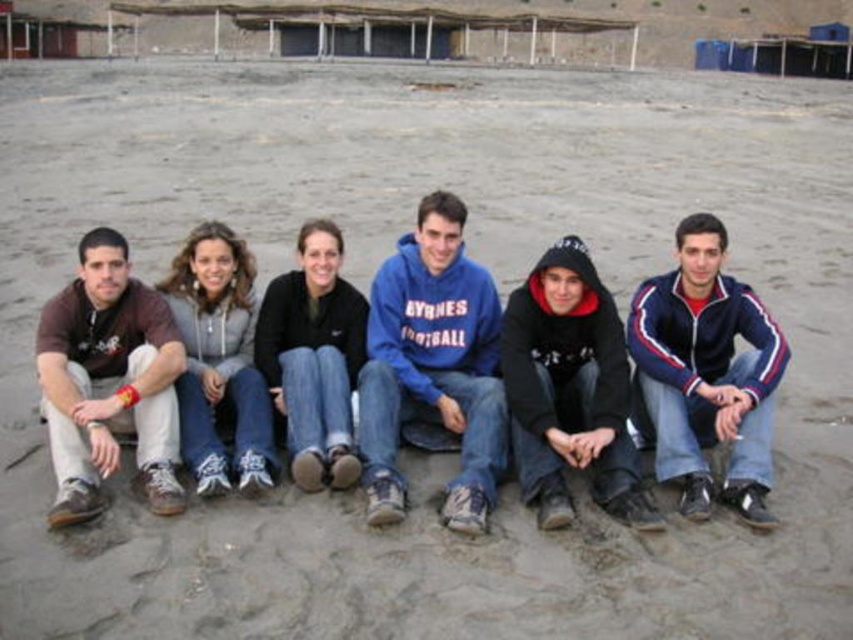
Does blue fleece sweatshirt at center appear on the left side of black hoodie at center?

Indeed, blue fleece sweatshirt at center is positioned on the left side of black hoodie at center.

Can you confirm if blue fleece sweatshirt at center is positioned to the right of black hoodie at center?

Incorrect, blue fleece sweatshirt at center is not on the right side of black hoodie at center.

Who is more distant from viewer, (366, 342) or (590, 353)?

Point (366, 342)

Find the location of a particular element. The width and height of the screenshot is (853, 640). blue fleece sweatshirt at center is located at coordinates (433, 365).

Between brown cotton shirt at left and black fleece jacket at center, which one appears on the left side from the viewer's perspective?

Positioned to the left is brown cotton shirt at left.

Between point (115, 282) and point (287, 316), which one is positioned behind?

The point (287, 316) is behind.

Image resolution: width=853 pixels, height=640 pixels. In order to click on brown cotton shirt at left in this screenshot , I will do (108, 381).

From the picture: Does blue/white/red track jacket at lower right appear on the right side of black hoodie at center?

Correct, you'll find blue/white/red track jacket at lower right to the right of black hoodie at center.

Who is shorter, blue/white/red track jacket at lower right or black hoodie at center?

black hoodie at center is shorter.

Is point (730, 448) positioned behind point (555, 272)?

No, it is not.

You are a GUI agent. You are given a task and a screenshot of the screen. Output one action in this format:
    pyautogui.click(x=<x>, y=<y>)
    Task: Click on the blue/white/red track jacket at lower right
    
    Given the screenshot: What is the action you would take?
    pyautogui.click(x=706, y=374)